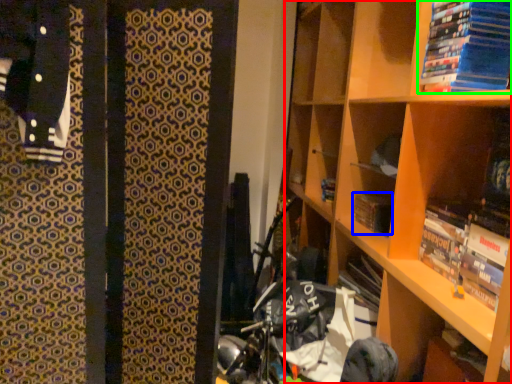
Question: Which object is positioned farthest from shelf (highlighted by a red box)? Select from paperback book (highlighted by a blue box) and book (highlighted by a green box).

Choices:
 (A) paperback book
 (B) book

Answer: (A)